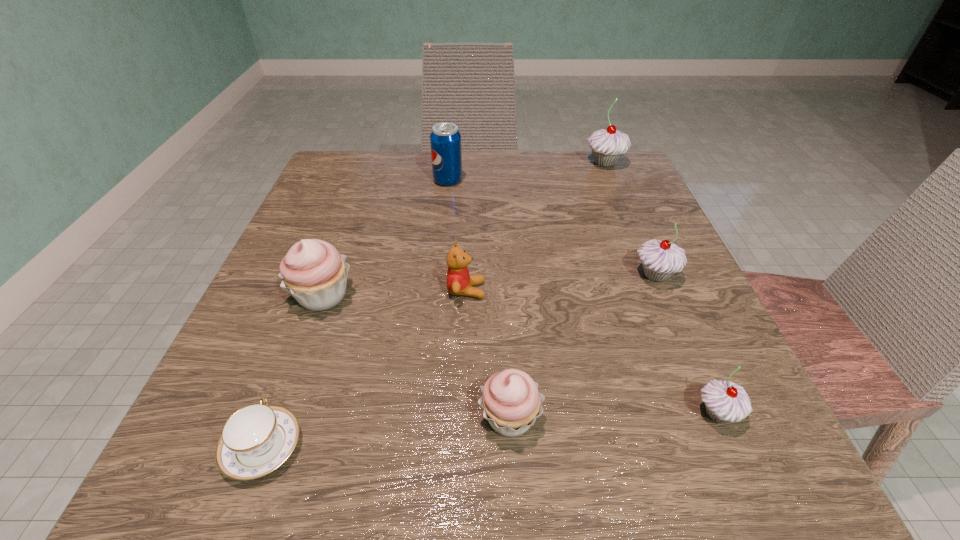
Image resolution: width=960 pixels, height=540 pixels. What are the coordinates of `vacant space at the far edge of the desktop` in the screenshot? It's located at (520, 186).

I want to click on free region at the near edge of the desktop, so click(x=484, y=449).

The image size is (960, 540). Find the location of `vacant space at the left edge of the desktop`. vacant space at the left edge of the desktop is located at coordinates click(x=365, y=253).

Where is `free location at the right edge`? This screenshot has width=960, height=540. free location at the right edge is located at coordinates point(637,221).

Locate an element on the screen. blank space at the far right corner is located at coordinates (633, 162).

Find the location of a particular element. free region at the near right corner of the desktop is located at coordinates (701, 439).

Where is `empty space between the blue pop soda and the teddy bear`? empty space between the blue pop soda and the teddy bear is located at coordinates (457, 235).

Find the location of a particular element. This screenshot has width=960, height=540. unoccupied area between the bigger pink cupcake and the right pink cupcake is located at coordinates (416, 357).

Where is `free spot between the teacup and the biggest gray cupcake`? free spot between the teacup and the biggest gray cupcake is located at coordinates (434, 305).

This screenshot has width=960, height=540. I want to click on free space between the blue pop soda and the teacup, so click(x=355, y=314).